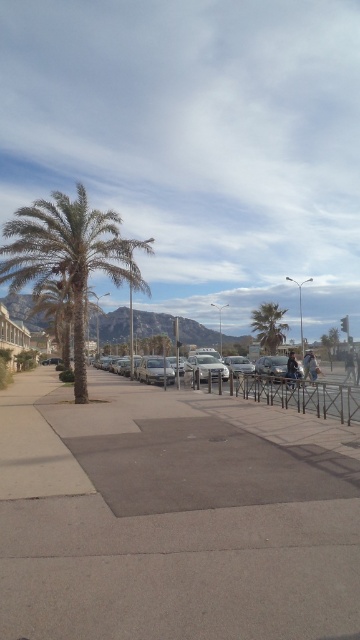
Question: Does green leafy palm tree at left appear on the left side of denim jacket at lower right?

Choices:
 (A) yes
 (B) no

Answer: (A)

Question: Is green leafy palm tree at center smaller than dark gray jacket at center?

Choices:
 (A) no
 (B) yes

Answer: (B)

Question: Which object is farther from the camera taking this photo?

Choices:
 (A) green leafy palm tree at left
 (B) denim jacket at lower right

Answer: (A)

Question: Is silver metallic cars at center smaller than green leafy palm tree at center?

Choices:
 (A) no
 (B) yes

Answer: (A)

Question: Which of the following is the farthest from the observer?

Choices:
 (A) (299, 627)
 (B) (187, 360)

Answer: (B)

Question: Which point is farther to the camera?

Choices:
 (A) denim jacket at lower right
 (B) gray concrete pavement at center
 (C) silver metallic cars at center

Answer: (A)